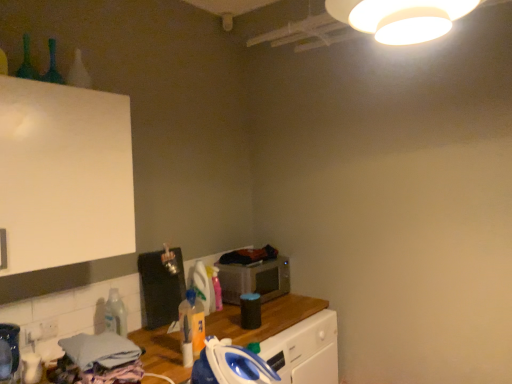
Question: Does metallic silver microwave at center have a lesser height compared to clear plastic bottle at lower left, which is the first bottle from bottom to top?

Choices:
 (A) yes
 (B) no

Answer: (A)

Question: Does metallic silver microwave at center contain clear plastic bottle at lower left, acting as the 2th bottle starting from the right?

Choices:
 (A) yes
 (B) no

Answer: (B)

Question: From the image's perspective, would you say metallic silver microwave at center is positioned over clear plastic bottle at lower left, marked as the third bottle in a top-to-bottom arrangement?

Choices:
 (A) no
 (B) yes

Answer: (B)

Question: Is metallic silver microwave at center taller than clear plastic bottle at lower left, acting as the 2th bottle starting from the right?

Choices:
 (A) yes
 (B) no

Answer: (B)

Question: From a real-world perspective, is metallic silver microwave at center positioned under clear plastic bottle at lower left, acting as the 2th bottle starting from the right, based on gravity?

Choices:
 (A) yes
 (B) no

Answer: (A)

Question: From a real-world perspective, relative to blue plastic iron at lower center, is metallic silver microwave at center vertically above or below?

Choices:
 (A) above
 (B) below

Answer: (A)

Question: Would you say metallic silver microwave at center is to the left or to the right of blue plastic iron at lower center in the picture?

Choices:
 (A) right
 (B) left

Answer: (A)

Question: Considering their positions, is metallic silver microwave at center located in front of or behind blue plastic iron at lower center?

Choices:
 (A) front
 (B) behind

Answer: (B)

Question: Based on their sizes in the image, would you say metallic silver microwave at center is bigger or smaller than blue plastic iron at lower center?

Choices:
 (A) big
 (B) small

Answer: (A)

Question: In the image, is translucent plastic bottle at center, which appears as the second bottle when viewed from the front, positioned in front of or behind green glass bottle at upper left, the 1th bottle viewed from the left?

Choices:
 (A) front
 (B) behind

Answer: (B)

Question: Is point (198, 334) closer or farther from the camera than point (53, 76)?

Choices:
 (A) farther
 (B) closer

Answer: (B)

Question: Do you think translucent plastic bottle at center, the 1th bottle in the right-to-left sequence, is within green glass bottle at upper left, which is the third bottle in back-to-front order, or outside of it?

Choices:
 (A) inside
 (B) outside

Answer: (B)

Question: Considering the positions of translucent plastic bottle at center, acting as the second bottle starting from the bottom, and green glass bottle at upper left, acting as the 3th bottle starting from the right, in the image, is translucent plastic bottle at center, acting as the second bottle starting from the bottom, wider or thinner than green glass bottle at upper left, acting as the 3th bottle starting from the right,?

Choices:
 (A) wide
 (B) thin

Answer: (A)

Question: From a real-world perspective, relative to clear plastic bottle at lower left, the second bottle positioned from the left, is translucent plastic bottle at center, which appears as the 2th bottle when viewed from the back, vertically above or below?

Choices:
 (A) below
 (B) above

Answer: (B)

Question: Choose the correct answer: Is translucent plastic bottle at center, which is the third bottle in left-to-right order, inside clear plastic bottle at lower left, the second bottle positioned from the left, or outside it?

Choices:
 (A) outside
 (B) inside

Answer: (A)